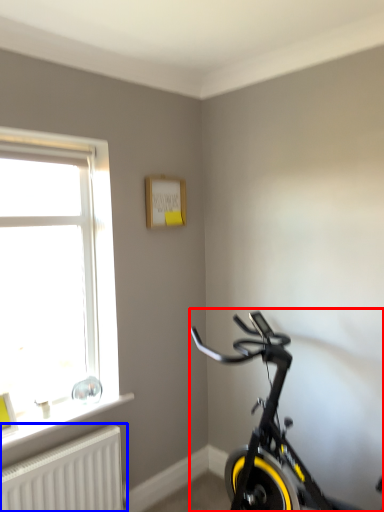
Question: Which point is further to the camera, bicycle (highlighted by a red box) or radiator (highlighted by a blue box)?

Choices:
 (A) bicycle
 (B) radiator

Answer: (B)